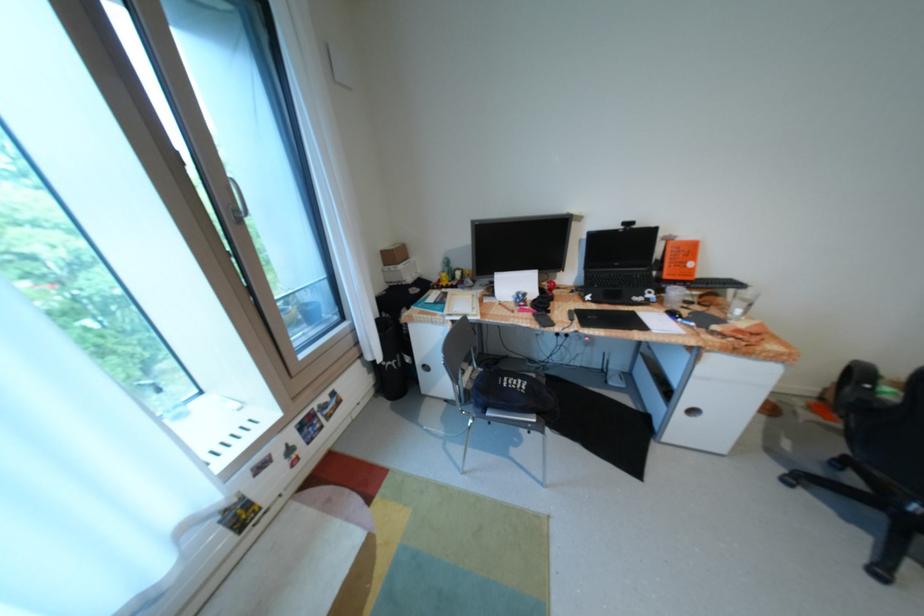
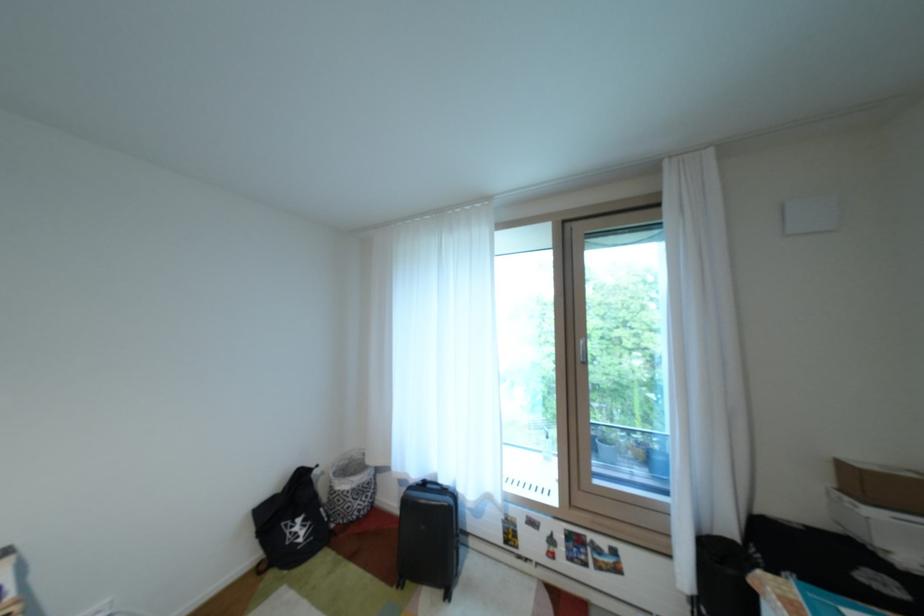
Question: The first image is from the beginning of the video and the second image is from the end. How did the camera likely rotate when shooting the video?

Choices:
 (A) Left
 (B) Right
 (C) Up
 (D) Down

Answer: (A)